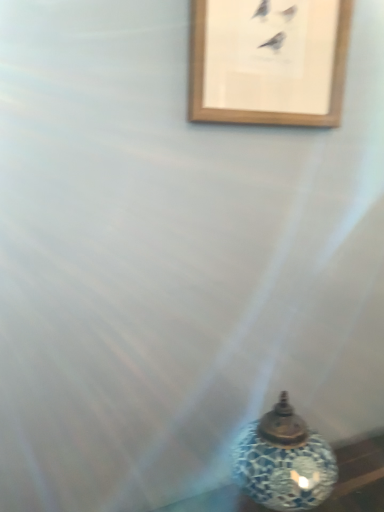
Question: In terms of size, does blue mosaic oil lamp at lower right appear bigger or smaller than wooden picture frame at upper center?

Choices:
 (A) small
 (B) big

Answer: (B)

Question: Relative to wooden picture frame at upper center, is blue mosaic oil lamp at lower right in front or behind?

Choices:
 (A) front
 (B) behind

Answer: (A)

Question: Which is correct: blue mosaic oil lamp at lower right is inside wooden picture frame at upper center, or outside of it?

Choices:
 (A) outside
 (B) inside

Answer: (A)

Question: Would you say wooden picture frame at upper center is to the left or to the right of blue mosaic oil lamp at lower right in the picture?

Choices:
 (A) right
 (B) left

Answer: (B)

Question: Considering the positions of wooden picture frame at upper center and blue mosaic oil lamp at lower right in the image, is wooden picture frame at upper center bigger or smaller than blue mosaic oil lamp at lower right?

Choices:
 (A) small
 (B) big

Answer: (A)

Question: Considering the positions of wooden picture frame at upper center and blue mosaic oil lamp at lower right in the image, is wooden picture frame at upper center wider or thinner than blue mosaic oil lamp at lower right?

Choices:
 (A) thin
 (B) wide

Answer: (A)

Question: Do you think wooden picture frame at upper center is within blue mosaic oil lamp at lower right, or outside of it?

Choices:
 (A) outside
 (B) inside

Answer: (A)